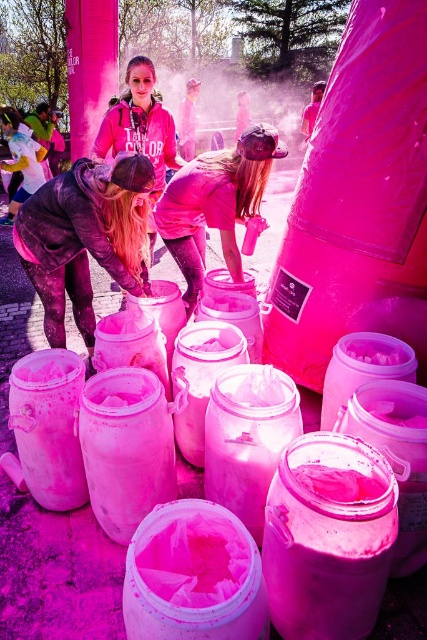
Question: Is the position of matte pink bucket at center more distant than that of matte pink hoodie at center?

Choices:
 (A) yes
 (B) no

Answer: (A)

Question: Does matte black jacket at left have a greater width compared to matte pink bucket at center?

Choices:
 (A) yes
 (B) no

Answer: (B)

Question: Which point is farther from the camera taking this photo?

Choices:
 (A) (257, 186)
 (B) (93, 177)

Answer: (A)

Question: Does matte black jacket at left appear on the right side of matte pink hoodie at center?

Choices:
 (A) yes
 (B) no

Answer: (B)

Question: Considering the real-world distances, which object is closest to the matte pink hoodie at center?

Choices:
 (A) matte black jacket at left
 (B) matte pink bucket at center

Answer: (B)

Question: Which of the following is the closest to the observer?

Choices:
 (A) (199, 257)
 (B) (56, 195)

Answer: (B)